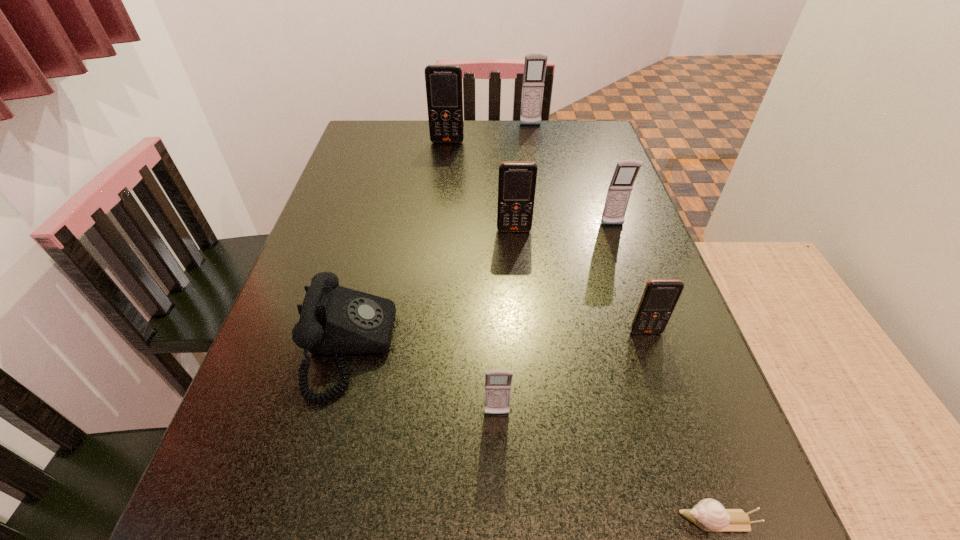
At what (x,y) coordinates should I click in order to perform the action: click on free spot between the biggest gray cellular telephone and the second farthest gray cellular telephone. Please return your answer as a coordinate pair (x, y). The width and height of the screenshot is (960, 540). Looking at the image, I should click on [571, 175].

The image size is (960, 540). Find the location of `vacant area that lies between the shortest object and the smallest orange cellular telephone`. vacant area that lies between the shortest object and the smallest orange cellular telephone is located at coordinates (682, 426).

Where is `free area in between the fifth object from left to right and the seventh nearest object`? The height and width of the screenshot is (540, 960). free area in between the fifth object from left to right and the seventh nearest object is located at coordinates (489, 133).

Identify the location of free area in between the nearest object and the smallest orange cellular telephone. (682, 426).

Identify which object is the third nearest to the shortest object. Please provide its 2D coordinates. Your answer should be formatted as a tuple, i.e. [(x, y)], where the tuple contains the x and y coordinates of a point satisfying the conditions above.

[(334, 320)]

Select which object appears as the fifth closest to the second biggest orange cellular telephone. Please provide its 2D coordinates. Your answer should be formatted as a tuple, i.e. [(x, y)], where the tuple contains the x and y coordinates of a point satisfying the conditions above.

[(497, 382)]

Find the location of a particular element. The width and height of the screenshot is (960, 540). cellular telephone that is the third closest one to the nearest cellular telephone is located at coordinates (620, 188).

Choose which cellular telephone is the second nearest neighbor to the shortest object. Please provide its 2D coordinates. Your answer should be formatted as a tuple, i.e. [(x, y)], where the tuple contains the x and y coordinates of a point satisfying the conditions above.

[(660, 297)]

Where is `the second closest gray cellular telephone relative to the second gray cellular telephone from right to left`? the second closest gray cellular telephone relative to the second gray cellular telephone from right to left is located at coordinates (497, 382).

Locate an element on the screen. Image resolution: width=960 pixels, height=540 pixels. gray cellular telephone object that ranks as the third closest to the second farthest cellular telephone is located at coordinates (497, 382).